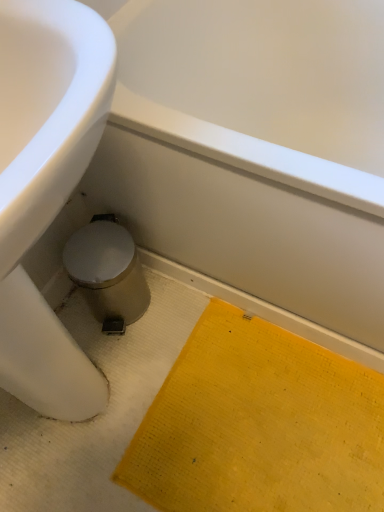
Question: Should I look upward or downward to see yellow textured mat at lower right?

Choices:
 (A) up
 (B) down

Answer: (B)